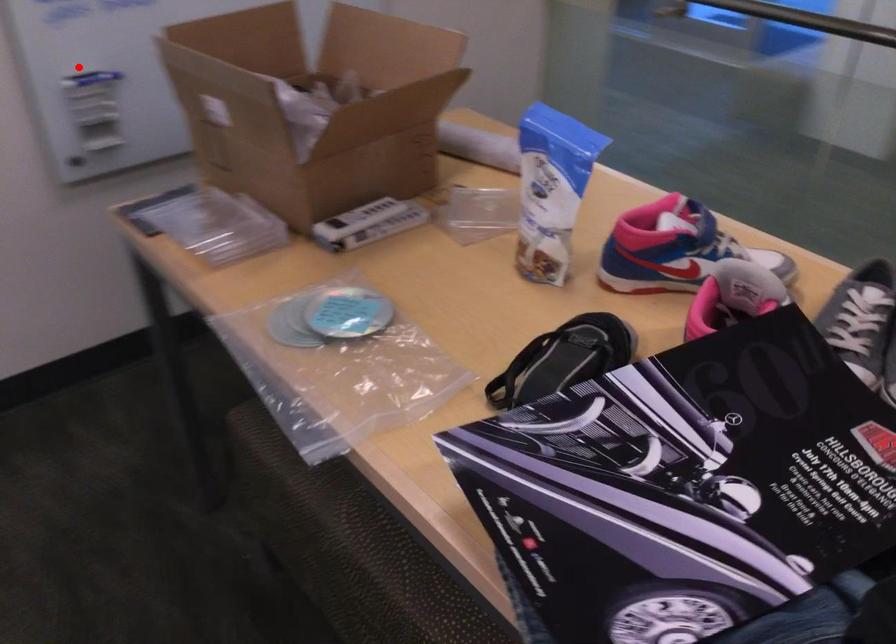
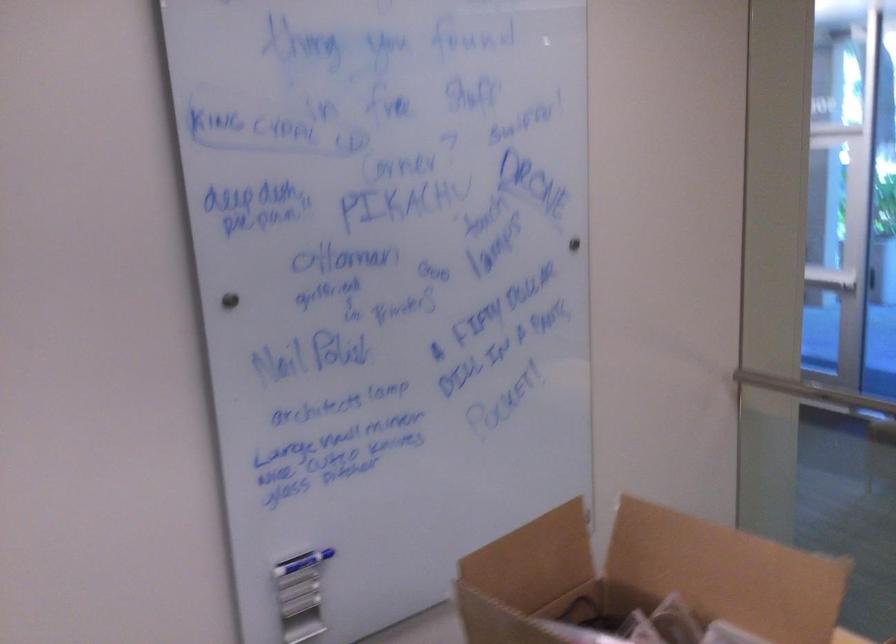
Find the pixel in the second image that matches the highlighted location in the first image.

(302, 562)